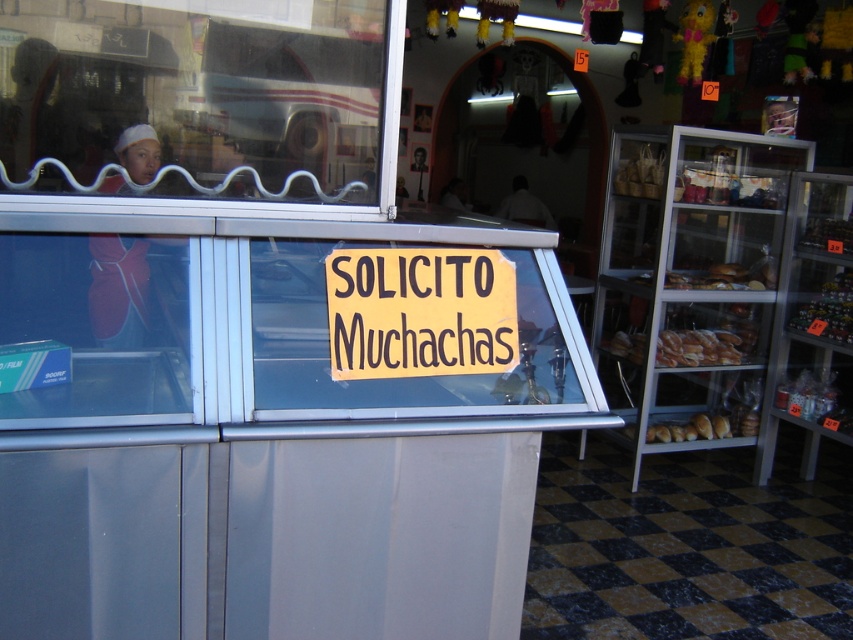
Is yellow paper sign at center positioned in front of dark brown bread at right?

Yes, yellow paper sign at center is closer to the viewer.

Is yellow paper sign at center to the left of dark brown bread at right from the viewer's perspective?

Indeed, yellow paper sign at center is positioned on the left side of dark brown bread at right.

Is point (376, 317) less distant than point (805, 316)?

Yes, it is in front of point (805, 316).

Where is `yellow paper sign at center`? The height and width of the screenshot is (640, 853). yellow paper sign at center is located at coordinates (419, 310).

In the scene shown: Who is positioned more to the left, transparent plastic window at left or dark brown bread at right?

transparent plastic window at left is more to the left.

Is transparent plastic window at left shorter than dark brown bread at right?

Correct, transparent plastic window at left is not as tall as dark brown bread at right.

Who is more distant from viewer, (x=163, y=340) or (x=828, y=300)?

Positioned behind is point (x=828, y=300).

At what (x,y) coordinates should I click in order to perform the action: click on transparent plastic window at left. Please return your answer as a coordinate pair (x, y). The height and width of the screenshot is (640, 853). Looking at the image, I should click on (93, 328).

Does transparent glass window at center have a lesser height compared to transparent plastic window at left?

In fact, transparent glass window at center may be taller than transparent plastic window at left.

Where is `transparent glass window at center`? transparent glass window at center is located at coordinates (201, 99).